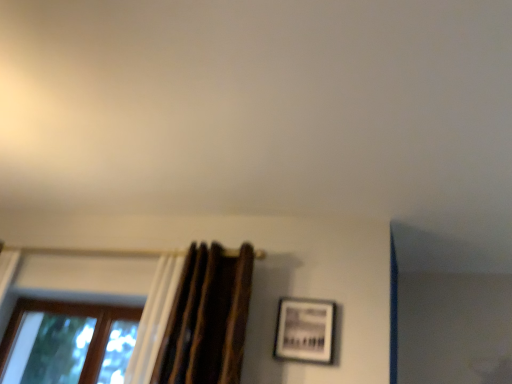
Question: Is point (317, 339) positioned closer to the camera than point (233, 377)?

Choices:
 (A) closer
 (B) farther

Answer: (B)

Question: Based on their positions, is matte black picture frame at center-right located to the left or right of brown textured curtain at left?

Choices:
 (A) right
 (B) left

Answer: (A)

Question: Estimate the real-world distances between objects in this image. Which object is farther from the matte black picture frame at center-right?

Choices:
 (A) brown wooden window at lower left
 (B) brown textured curtain at left

Answer: (A)

Question: Which object is the closest to the matte black picture frame at center-right?

Choices:
 (A) brown wooden window at lower left
 (B) brown textured curtain at left

Answer: (B)